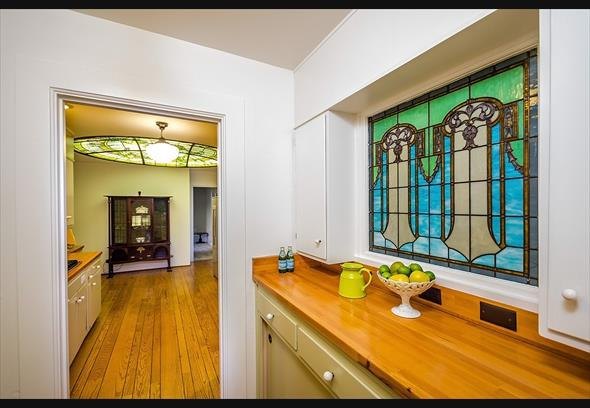
Find the location of `floor`. floor is located at coordinates (157, 348).